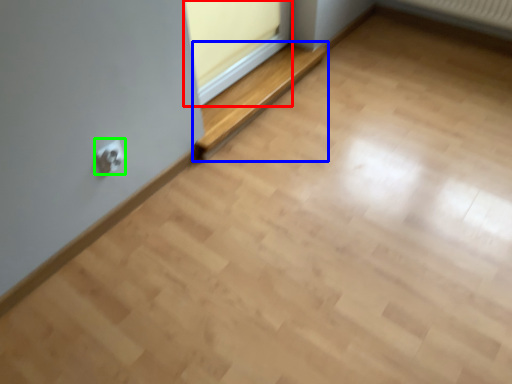
Question: Considering the real-world distances, which object is closest to window frame (highlighted by a red box)? balustrade (highlighted by a blue box) or electric outlet (highlighted by a green box).

Choices:
 (A) balustrade
 (B) electric outlet

Answer: (A)